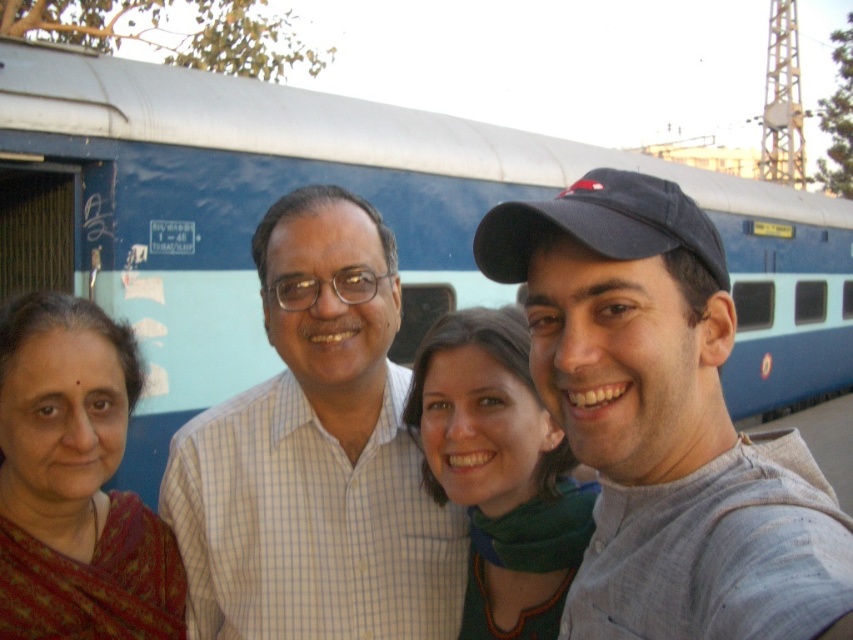
You are a photographer trying to capture the blue painted train at center and the green fabric scarf at center in a single shot. Which object should you focus on first to ensure both are in frame?

You should focus on the blue painted train at center first since it is closer to you than the green fabric scarf at center, allowing you to adjust the framing to include both objects.

You are a photographer trying to capture the group and the train in a single frame. Based on the scene, which object is positioned to the right of the other between the blue painted train at center and the green fabric scarf at center?

The blue painted train at center is positioned to the right of the green fabric scarf at center.